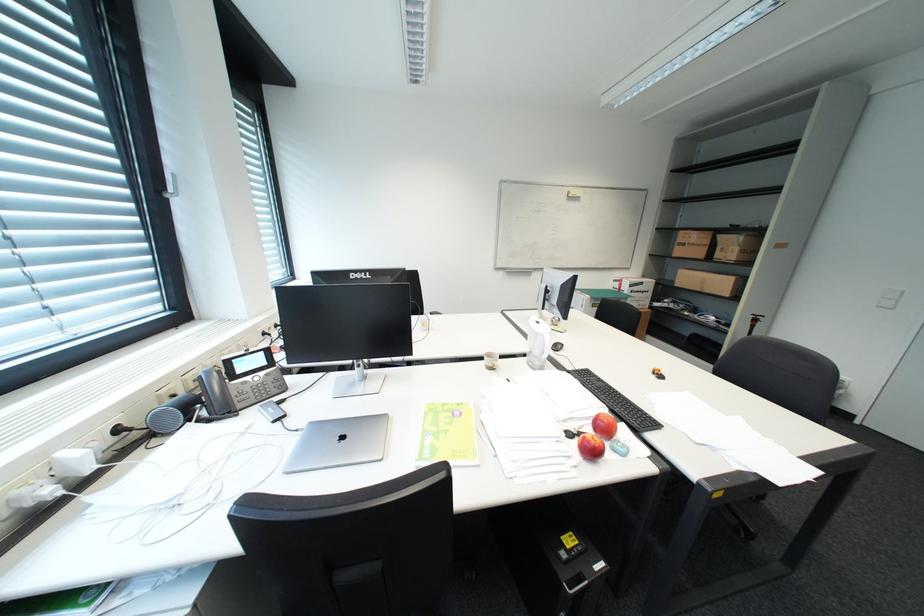
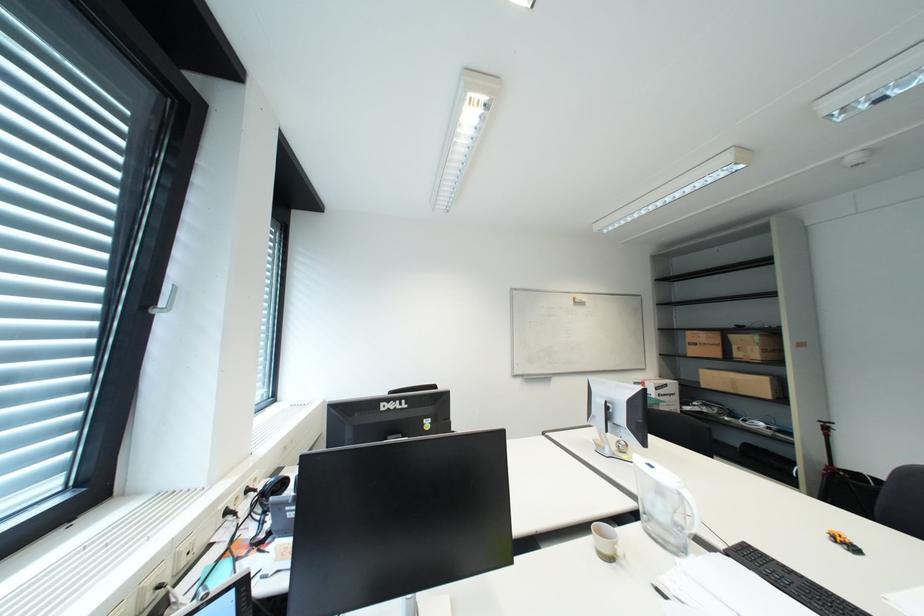
Question: How did the camera likely rotate?

Choices:
 (A) Left
 (B) Right
 (C) Up
 (D) Down

Answer: (C)